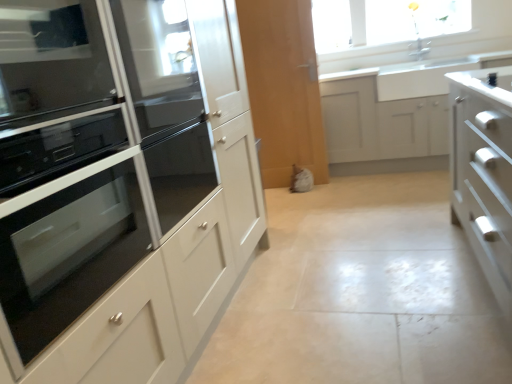
Question: Is point (459, 61) closer or farther from the camera than point (79, 273)?

Choices:
 (A) farther
 (B) closer

Answer: (A)

Question: From a real-world perspective, relative to black glass oven at left, is white matte cabinet at center, positioned as the 2th cabinetry in front-to-back order, vertically above or below?

Choices:
 (A) above
 (B) below

Answer: (B)

Question: Which is farther from the white ceramic sink at upper right?

Choices:
 (A) black glass oven at left
 (B) white matte cabinet at center, positioned as the second cabinetry in left-to-right order
 (C) matte white oven at left, placed as the first cabinetry when sorted from front to back
 (D) black glass oven at left

Answer: (A)

Question: Which is farther from the black glass oven at left?

Choices:
 (A) matte white oven at left, the second cabinetry positioned from the back
 (B) white ceramic sink at upper right
 (C) white matte cabinet at center, positioned as the 2th cabinetry in front-to-back order
 (D) black glass oven at left

Answer: (B)